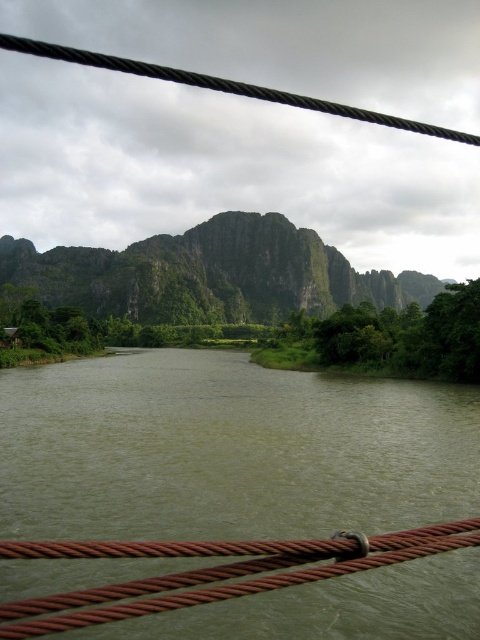
Can you confirm if green murky water at center is bigger than green rocky mountain at center?

No, green murky water at center is not bigger than green rocky mountain at center.

Image resolution: width=480 pixels, height=640 pixels. Describe the element at coordinates (228, 451) in the screenshot. I see `green murky water at center` at that location.

Does point (300, 536) come in front of point (143, 298)?

Yes, it is.

You are a GUI agent. You are given a task and a screenshot of the screen. Output one action in this format:
    pyautogui.click(x=<x>, y=<y>)
    Task: Click on the green murky water at center
    The height and width of the screenshot is (640, 480).
    Given the screenshot: What is the action you would take?
    pyautogui.click(x=228, y=451)

Can you confirm if green murky water at center is thinner than rusty metal rope bridge at center?

Incorrect, green murky water at center's width is not less than rusty metal rope bridge at center's.

Based on the photo, is green murky water at center below rusty metal rope bridge at center?

Correct, green murky water at center is located below rusty metal rope bridge at center.

Between point (10, 417) and point (84, 612), which one is positioned in front?

Positioned in front is point (84, 612).

Image resolution: width=480 pixels, height=640 pixels. I want to click on green murky water at center, so pyautogui.click(x=228, y=451).

Can you confirm if green rocky mountain at center is taller than rusty metal rope bridge at center?

Yes.

I want to click on green rocky mountain at center, so click(211, 275).

This screenshot has width=480, height=640. I want to click on green rocky mountain at center, so click(211, 275).